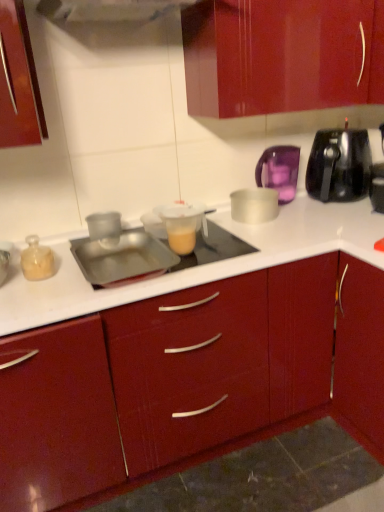
The width and height of the screenshot is (384, 512). What are the coordinates of `spots to the right of translucent plastic measuring cup at center, placed as the first appliance when sorted from right to left` in the screenshot? It's located at (233, 247).